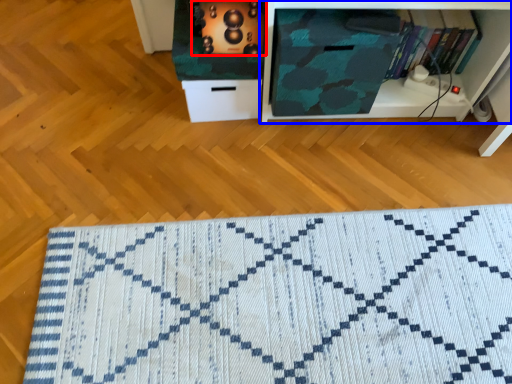
Question: Which point is closer to the camera, appliance (highlighted by a red box) or shelf (highlighted by a blue box)?

Choices:
 (A) appliance
 (B) shelf

Answer: (A)